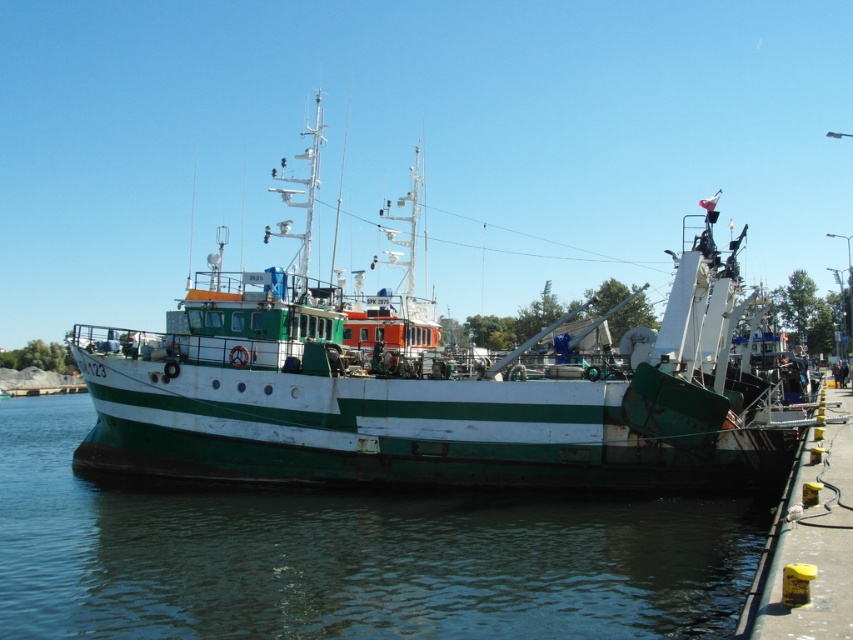
Which is behind, point (741, 497) or point (227, 406)?

Positioned behind is point (227, 406).

Does green matte water at lower center have a larger size compared to green matte boat at center?

Incorrect, green matte water at lower center is not larger than green matte boat at center.

Between point (244, 582) and point (292, 278), which one is positioned in front?

Positioned in front is point (244, 582).

Image resolution: width=853 pixels, height=640 pixels. I want to click on green matte water at lower center, so coord(349,556).